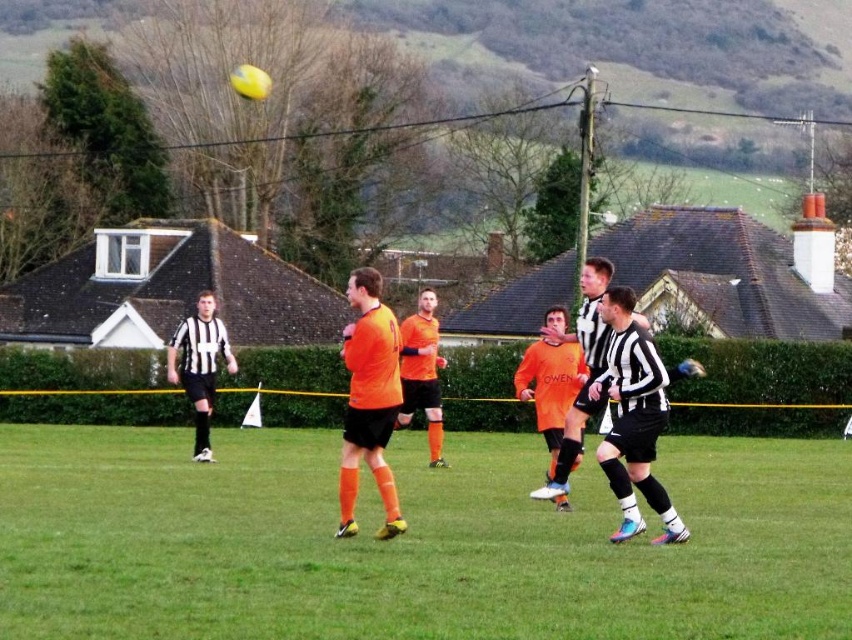
Question: Does green grass at center have a smaller size compared to matte black jersey at left?

Choices:
 (A) yes
 (B) no

Answer: (A)

Question: Which of the following is the farthest from the observer?

Choices:
 (A) (579, 436)
 (B) (668, 451)
 (C) (176, 332)

Answer: (C)

Question: Does orange matte jersey at center appear under matte black jersey at left?

Choices:
 (A) no
 (B) yes

Answer: (B)

Question: Does green grass at center come in front of orange matte jersey at center?

Choices:
 (A) no
 (B) yes

Answer: (B)

Question: Which point is farther to the camera?

Choices:
 (A) (194, 310)
 (B) (567, 422)

Answer: (A)

Question: Based on their relative distances, which object is nearer to the matte black jersey at left?

Choices:
 (A) green grass at center
 (B) black and white striped shirt at center

Answer: (A)